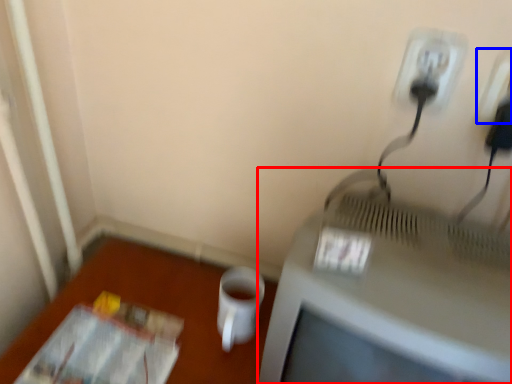
Question: Which object appears closest to the camera in this image, television (highlighted by a red box) or electric outlet (highlighted by a blue box)?

Choices:
 (A) television
 (B) electric outlet

Answer: (A)